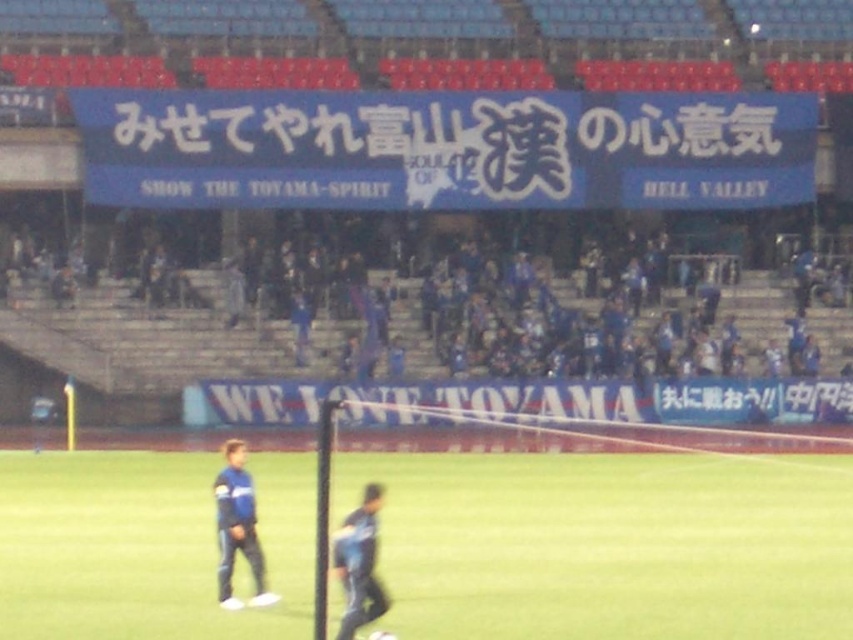
Is green grass field at center to the right of blue fabric pants at lower center from the viewer's perspective?

Indeed, green grass field at center is positioned on the right side of blue fabric pants at lower center.

Consider the image. Is green grass field at center positioned behind blue fabric pants at lower center?

No.

Which is behind, point (486, 488) or point (346, 604)?

Positioned behind is point (486, 488).

This screenshot has height=640, width=853. I want to click on green grass field at center, so click(610, 544).

Locate an element on the screen. This screenshot has height=640, width=853. blue fabric at upper center is located at coordinates (363, 301).

Looking at this image, between green grass field at center and blue fabric at upper center, which one is positioned higher?

blue fabric at upper center is above.

Looking at this image, is green grass field at center behind blue fabric at upper center?

That is False.

Between point (671, 593) and point (614, 316), which one is positioned behind?

The point (614, 316) is more distant.

Find the location of a particular element. This screenshot has width=853, height=640. green grass field at center is located at coordinates (610, 544).